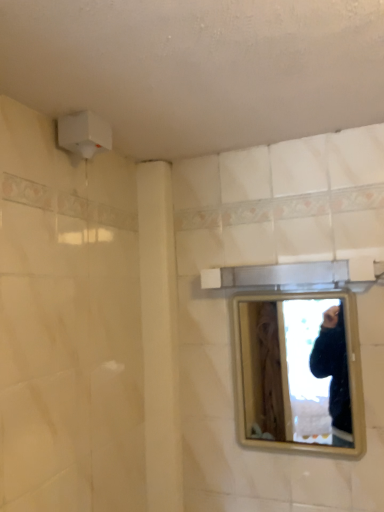
Measure the distance between gold-framed mirror at center and camera.

gold-framed mirror at center is 1.08 meters away from camera.

Describe the element at coordinates (295, 371) in the screenshot. I see `gold-framed mirror at center` at that location.

Locate an element on the screen. This screenshot has height=512, width=384. gold-framed mirror at center is located at coordinates (295, 371).

Find the location of `gold-framed mirror at center`. gold-framed mirror at center is located at coordinates (295, 371).